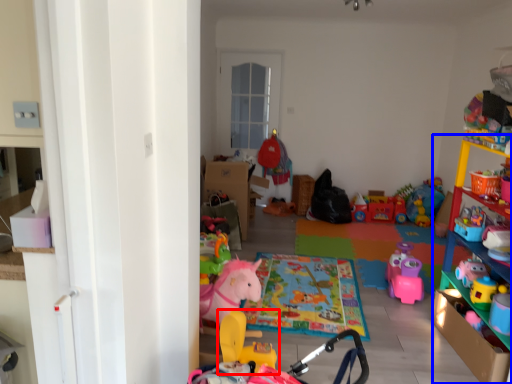
Question: Among these objects, which one is nearest to the camera, toy (highlighted by a red box) or shelf (highlighted by a blue box)?

Choices:
 (A) toy
 (B) shelf

Answer: (B)